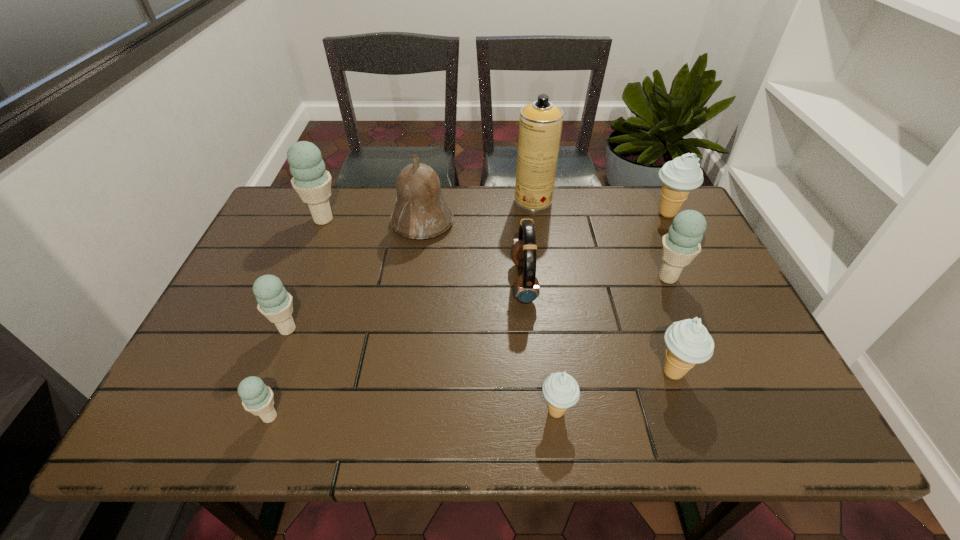
Find the location of a particular element. The height and width of the screenshot is (540, 960). the tallest object is located at coordinates (540, 126).

Where is `the biggest blue ice cream`? The image size is (960, 540). the biggest blue ice cream is located at coordinates (311, 181).

Where is `the tallest ice cream`? the tallest ice cream is located at coordinates (311, 181).

Where is `bell`? The height and width of the screenshot is (540, 960). bell is located at coordinates (421, 212).

What are the coordinates of `the farthest beige icecream` in the screenshot? It's located at (679, 176).

Locate an element on the screen. This screenshot has width=960, height=540. the rightmost beige icecream is located at coordinates (679, 176).

The image size is (960, 540). Find the location of `the third smallest blue ice cream`. the third smallest blue ice cream is located at coordinates (681, 244).

What are the coordinates of `the fifth nearest ice cream` in the screenshot? It's located at (681, 244).

The height and width of the screenshot is (540, 960). I want to click on brown headset, so click(x=526, y=288).

At what (x,y) coordinates should I click in order to perform the action: click on the second farthest beige icecream. Please return your answer as a coordinate pair (x, y). The image size is (960, 540). Looking at the image, I should click on (688, 342).